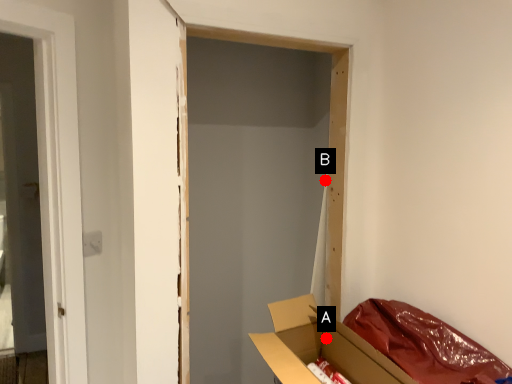
Question: Two points are circled on the image, labeled by A and B beside each circle. Which point is further to the camera?

Choices:
 (A) A is further
 (B) B is further

Answer: (B)